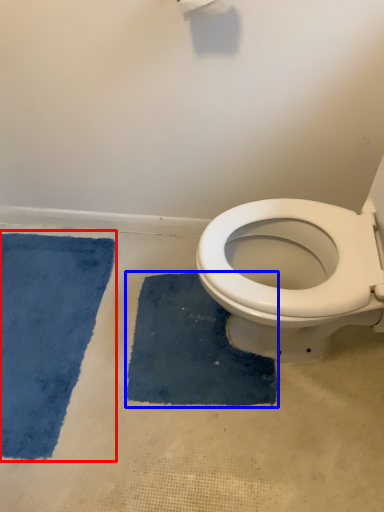
Question: Which object is further to the camera taking this photo, bath mat (highlighted by a red box) or bath mat (highlighted by a blue box)?

Choices:
 (A) bath mat
 (B) bath mat

Answer: (B)